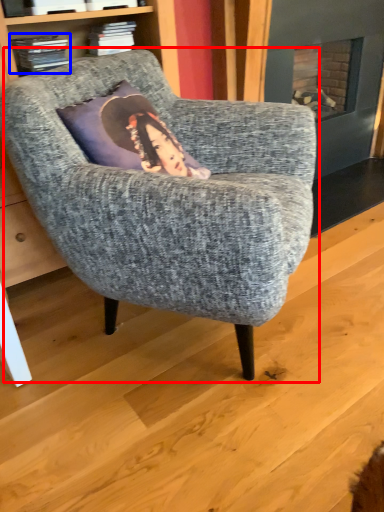
Question: Which point is closer to the camera, chair (highlighted by a red box) or book (highlighted by a blue box)?

Choices:
 (A) chair
 (B) book

Answer: (A)